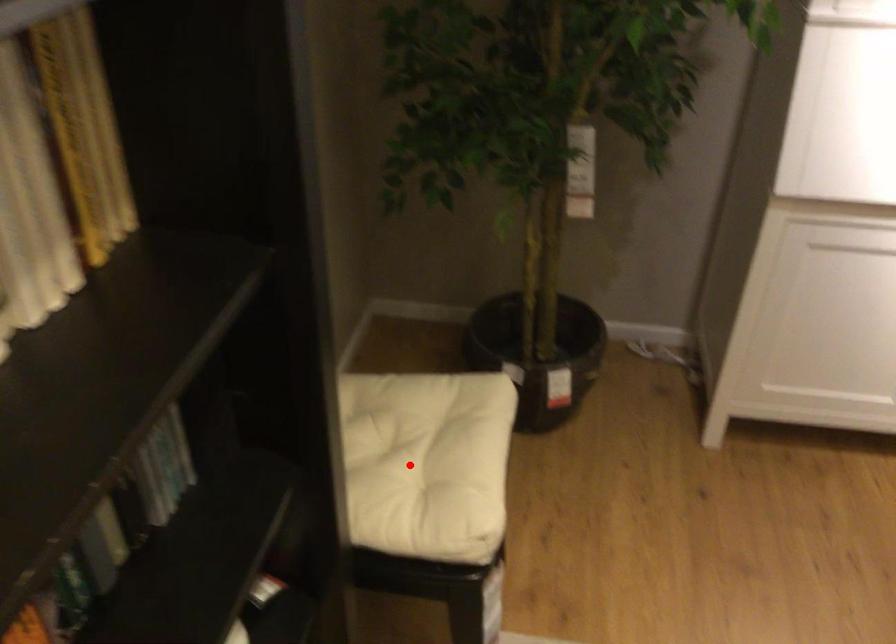
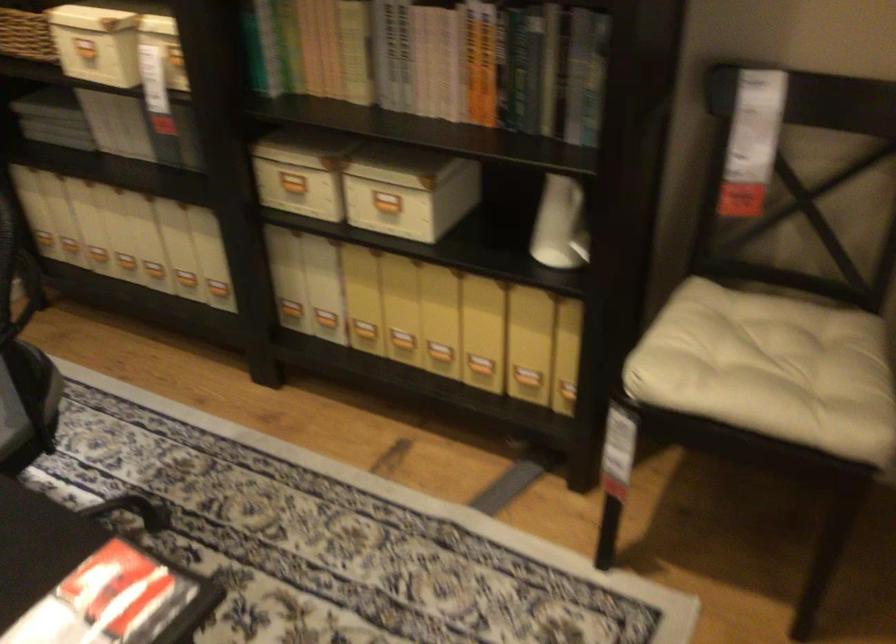
Where in the second image is the point corresponding to the highlighted location from the first image?

(776, 366)